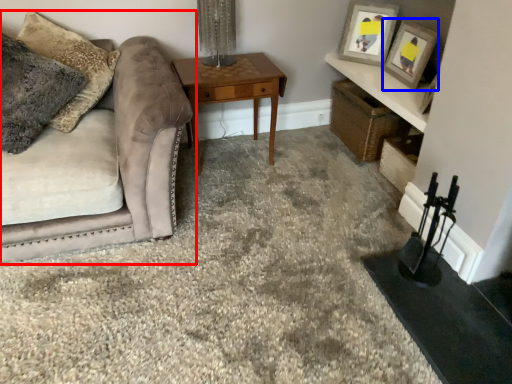
Question: Which of the following is the closest to the observer, studio couch (highlighted by a red box) or picture frame (highlighted by a blue box)?

Choices:
 (A) studio couch
 (B) picture frame

Answer: (A)